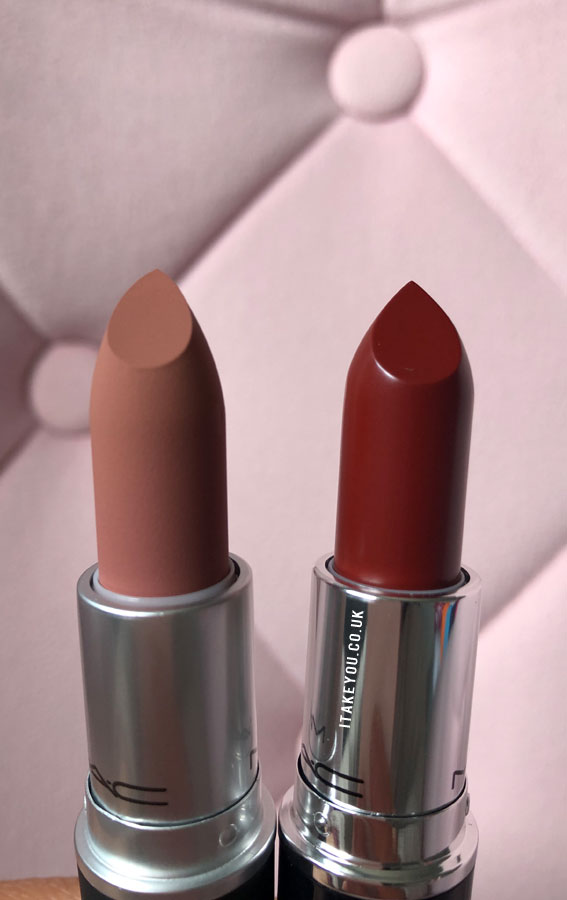
You are a GUI agent. You are given a task and a screenshot of the screen. Output one action in this format:
    pyautogui.click(x=<x>, y=<y>)
    Task: Click on the sofa triangle
    The image size is (567, 900).
    Given the screenshot: What is the action you would take?
    pyautogui.click(x=143, y=94), pyautogui.click(x=338, y=248), pyautogui.click(x=523, y=86), pyautogui.click(x=42, y=626), pyautogui.click(x=547, y=680)